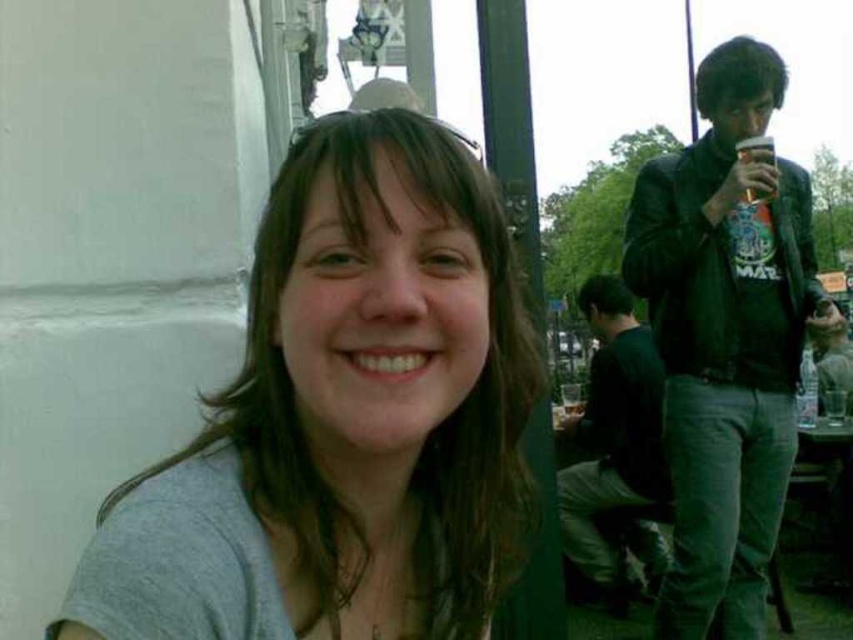
Does black leather jacket at upper right come in front of translucent plastic cup at upper right?

Yes, it is in front of translucent plastic cup at upper right.

Is black leather jacket at upper right wider than translucent plastic cup at upper right?

Correct, the width of black leather jacket at upper right exceeds that of translucent plastic cup at upper right.

Is point (753, 336) farther from viewer compared to point (747, 145)?

Yes.

Where is `black leather jacket at upper right`? This screenshot has height=640, width=853. black leather jacket at upper right is located at coordinates (726, 339).

Does point (334, 616) come in front of point (737, 154)?

Yes, point (334, 616) is in front of point (737, 154).

Does gray matte shirt at center appear on the right side of translucent plastic cup at upper right?

In fact, gray matte shirt at center is to the left of translucent plastic cup at upper right.

Between point (425, 128) and point (761, 195), which one is positioned in front?

Point (425, 128) is in front.

Find the location of a particular element. gray matte shirt at center is located at coordinates (381, 380).

Can you confirm if gray matte shirt at center is taller than black leather jacket at upper right?

Incorrect, gray matte shirt at center's height is not larger of black leather jacket at upper right's.

Does gray matte shirt at center have a lesser width compared to black leather jacket at upper right?

Correct, gray matte shirt at center's width is less than black leather jacket at upper right's.

The image size is (853, 640). What are the coordinates of `gray matte shirt at center` in the screenshot? It's located at (381, 380).

Where is `gray matte shirt at center`? Image resolution: width=853 pixels, height=640 pixels. gray matte shirt at center is located at coordinates (381, 380).